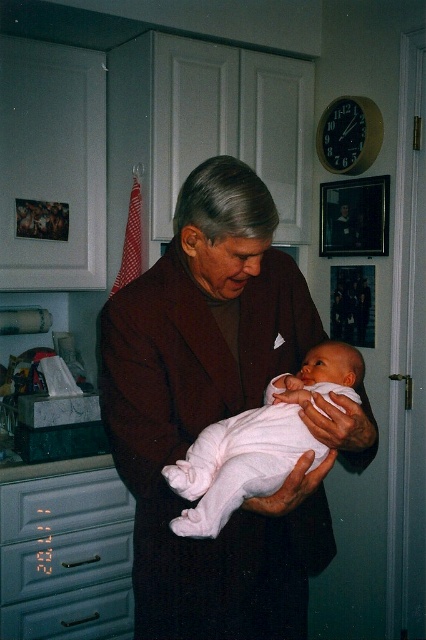
You are a photographer taking a picture of the scene. You notice the dark brown wool coat at center and the white soft fabric newborn at center. Which object is positioned higher in the image?

The white soft fabric newborn at center is positioned higher than the dark brown wool coat at center.

You are a tailor who needs to determine if the dark brown wool coat at center can fit into a storage box designed for the white soft fabric newborn at center. Based on their sizes, will the coat fit?

The dark brown wool coat at center is wider than the white soft fabric newborn at center, so it will not fit into the storage box designed for the newborn.